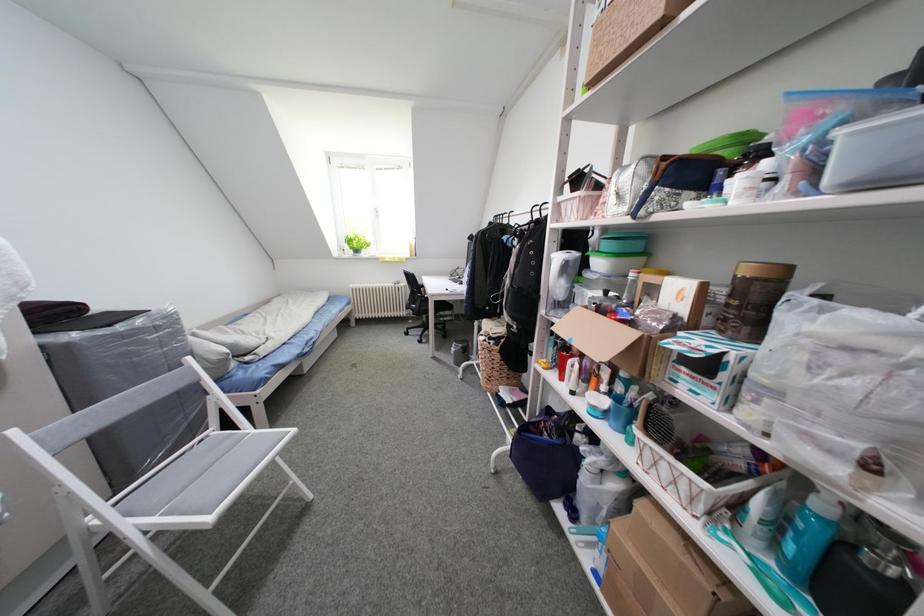
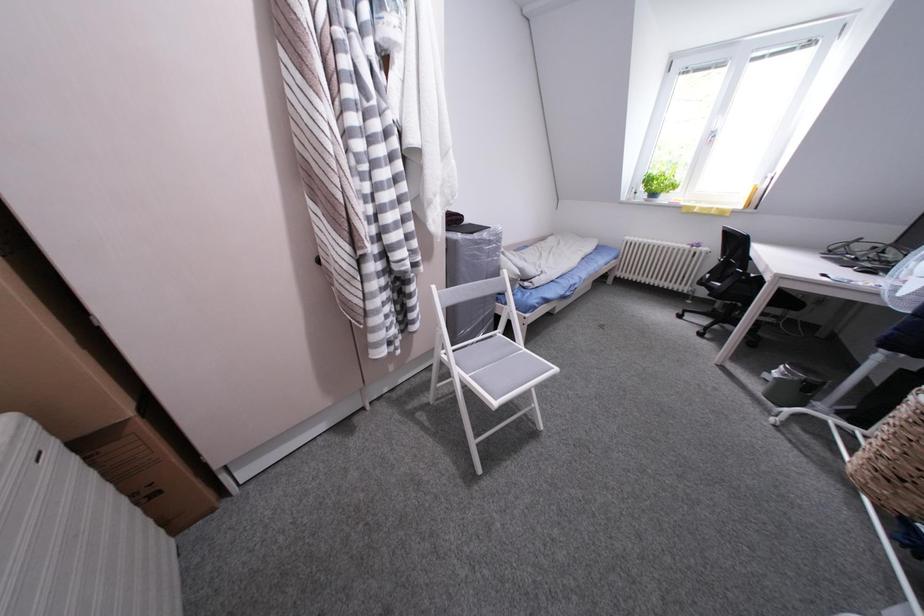
The images are taken continuously from a first-person perspective. In which direction is your viewpoint rotating?

The camera's rotation is toward left-down.